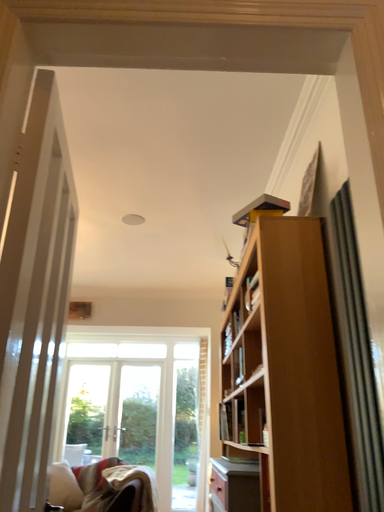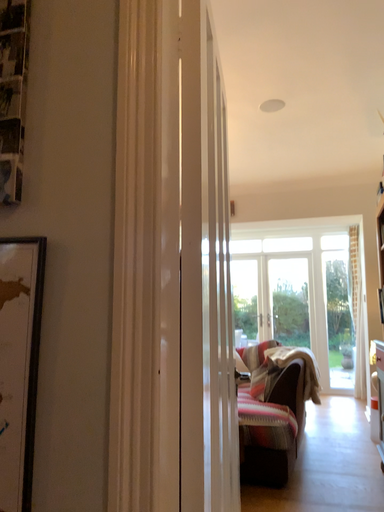
Question: Which way did the camera rotate in the video?

Choices:
 (A) rotated right
 (B) rotated left

Answer: (B)